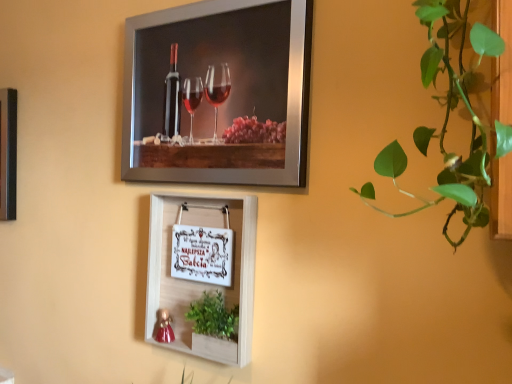
Question: Which direction should I rotate to face white wood picture frame at center, the 2th picture frame positioned from the top, — up or down?

Choices:
 (A) down
 (B) up

Answer: (A)

Question: Is metallic silver picture frame at upper center, positioned as the second picture frame in bottom-to-top order, far away from white wood picture frame at center, acting as the 1th picture frame starting from the bottom?

Choices:
 (A) no
 (B) yes

Answer: (A)

Question: Is metallic silver picture frame at upper center, marked as the first picture frame in a top-to-bottom arrangement, bigger than white wood picture frame at center, acting as the 1th picture frame starting from the bottom?

Choices:
 (A) yes
 (B) no

Answer: (A)

Question: Does metallic silver picture frame at upper center, marked as the first picture frame in a top-to-bottom arrangement, lie behind white wood picture frame at center, the 2th picture frame positioned from the top?

Choices:
 (A) no
 (B) yes

Answer: (A)

Question: From the image's perspective, would you say metallic silver picture frame at upper center, positioned as the second picture frame in bottom-to-top order, is shown under white wood picture frame at center, acting as the 1th picture frame starting from the bottom?

Choices:
 (A) yes
 (B) no

Answer: (B)

Question: Can you confirm if metallic silver picture frame at upper center, positioned as the second picture frame in bottom-to-top order, is wider than white wood picture frame at center, the 2th picture frame positioned from the top?

Choices:
 (A) yes
 (B) no

Answer: (B)

Question: Is metallic silver picture frame at upper center, marked as the first picture frame in a top-to-bottom arrangement, facing away from white wood picture frame at center, the 2th picture frame positioned from the top?

Choices:
 (A) no
 (B) yes

Answer: (A)

Question: Is the depth of green leafy plant at lower center less than that of metallic silver picture frame at upper center, marked as the first picture frame in a top-to-bottom arrangement?

Choices:
 (A) yes
 (B) no

Answer: (B)

Question: Is metallic silver picture frame at upper center, marked as the first picture frame in a top-to-bottom arrangement, located within green leafy plant at lower center?

Choices:
 (A) yes
 (B) no

Answer: (B)

Question: Can you confirm if green leafy plant at lower center is taller than metallic silver picture frame at upper center, positioned as the second picture frame in bottom-to-top order?

Choices:
 (A) no
 (B) yes

Answer: (A)

Question: From the image's perspective, would you say green leafy plant at lower center is shown under metallic silver picture frame at upper center, marked as the first picture frame in a top-to-bottom arrangement?

Choices:
 (A) yes
 (B) no

Answer: (A)

Question: From the image's perspective, is green leafy plant at lower center on top of metallic silver picture frame at upper center, marked as the first picture frame in a top-to-bottom arrangement?

Choices:
 (A) no
 (B) yes

Answer: (A)

Question: Considering the relative positions of green leafy plant at lower center and metallic silver picture frame at upper center, positioned as the second picture frame in bottom-to-top order, in the image provided, is green leafy plant at lower center to the left of metallic silver picture frame at upper center, positioned as the second picture frame in bottom-to-top order, from the viewer's perspective?

Choices:
 (A) no
 (B) yes

Answer: (A)

Question: From the image's perspective, is white wood picture frame at center, acting as the 1th picture frame starting from the bottom, under green leafy plant at lower center?

Choices:
 (A) yes
 (B) no

Answer: (B)